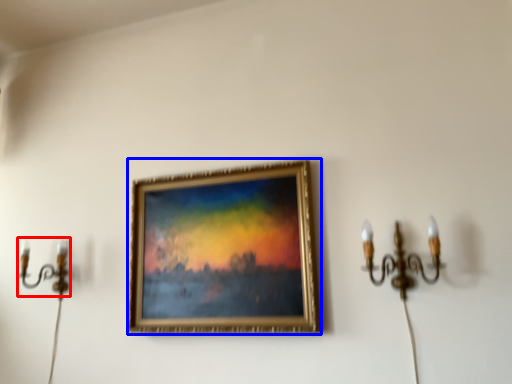
Question: Among these objects, which one is nearest to the camera, candle holder (highlighted by a red box) or picture frame (highlighted by a blue box)?

Choices:
 (A) candle holder
 (B) picture frame

Answer: (B)